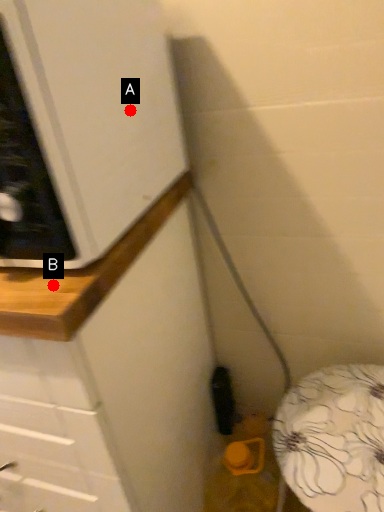
Question: Two points are circled on the image, labeled by A and B beside each circle. Which point is closer to the camera?

Choices:
 (A) A is closer
 (B) B is closer

Answer: (B)